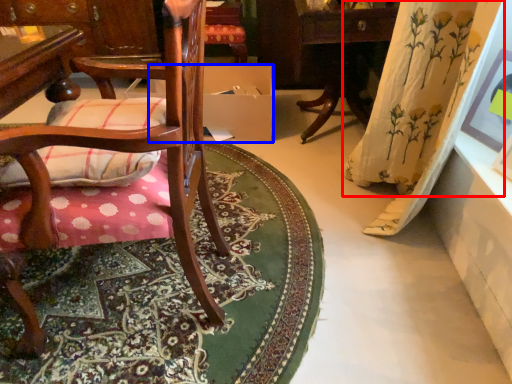
Question: Which of the following is the farthest to the observer, curtain (highlighted by a red box) or cardboard box (highlighted by a blue box)?

Choices:
 (A) curtain
 (B) cardboard box

Answer: (B)